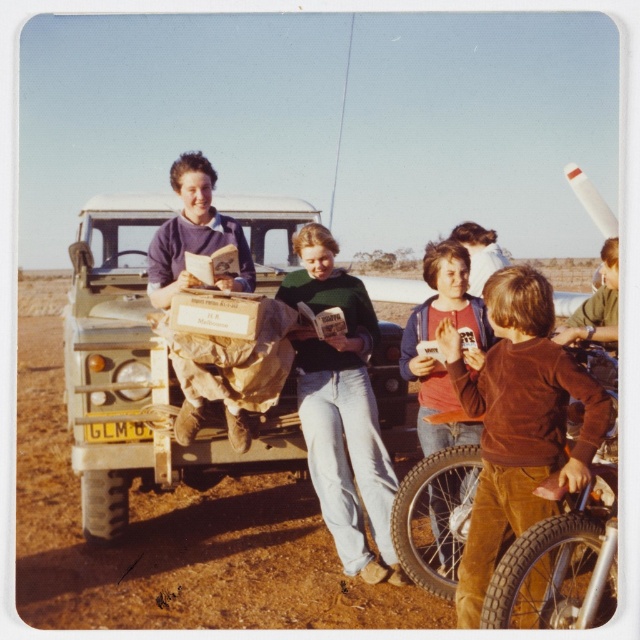
Which is below, light green matte truck at center or brown corduroy pants at lower right?

brown corduroy pants at lower right is below.

Is light green matte truck at center smaller than brown corduroy pants at lower right?

No.

You are a GUI agent. You are given a task and a screenshot of the screen. Output one action in this format:
    pyautogui.click(x=<x>, y=<y>)
    Task: Click on the light green matte truck at center
    The image size is (640, 640).
    Given the screenshot: What is the action you would take?
    pyautogui.click(x=138, y=378)

In order to click on light green matte truck at center in this screenshot , I will do `click(138, 378)`.